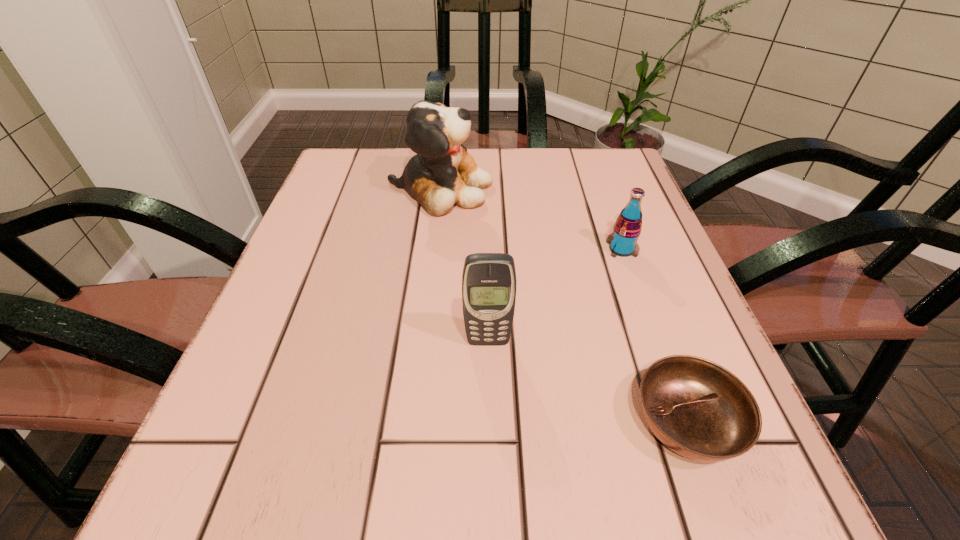
Where is `unoccupied area between the nearest object and the puppy`? The height and width of the screenshot is (540, 960). unoccupied area between the nearest object and the puppy is located at coordinates (564, 305).

Locate an element on the screen. This screenshot has height=540, width=960. free spot between the farthest object and the cellular telephone is located at coordinates (464, 265).

You are a GUI agent. You are given a task and a screenshot of the screen. Output one action in this format:
    pyautogui.click(x=<x>, y=<y>)
    Task: Click on the free space between the puppy and the third nearest object
    The height and width of the screenshot is (540, 960).
    Given the screenshot: What is the action you would take?
    pyautogui.click(x=531, y=219)

In order to click on empty space that is in between the second nearest object and the second farthest object in this screenshot , I will do `click(555, 295)`.

This screenshot has width=960, height=540. Find the location of `object that is the second closest to the puppy`. object that is the second closest to the puppy is located at coordinates 489,281.

At what (x,y) coordinates should I click in order to perform the action: click on object that stands as the second closest to the puppy. Please return your answer as a coordinate pair (x, y). Looking at the image, I should click on (489, 281).

What are the coordinates of `free region that satisfies the following two spatial constraints: 1. at the face of the puppy; 2. on the left side of the second shortest object` in the screenshot? It's located at (433, 249).

You are a GUI agent. You are given a task and a screenshot of the screen. Output one action in this format:
    pyautogui.click(x=<x>, y=<y>)
    Task: Click on the vacant space that satisfies the following two spatial constraints: 1. at the face of the farthest object; 2. on the right side of the shortest object
    Image resolution: width=960 pixels, height=540 pixels.
    Given the screenshot: What is the action you would take?
    pyautogui.click(x=412, y=421)

At what (x,y) coordinates should I click in order to perform the action: click on free location that satisfies the following two spatial constraints: 1. at the face of the soup bowl; 2. on the right side of the puppy. Please return your answer as a coordinate pair (x, y). The height and width of the screenshot is (540, 960). Looking at the image, I should click on (412, 421).

At what (x,y) coordinates should I click in order to perform the action: click on free location that satisfies the following two spatial constraints: 1. at the face of the second shortest object; 2. on the left side of the puppy. Please return your answer as a coordinate pair (x, y). Image resolution: width=960 pixels, height=540 pixels. Looking at the image, I should click on (433, 249).